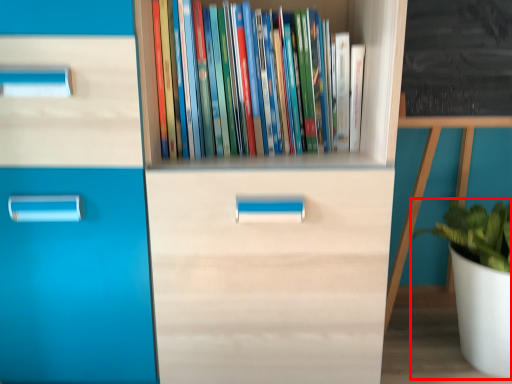
Question: From the image's perspective, where is houseplant (annotated by the red box) located relative to book?

Choices:
 (A) above
 (B) below

Answer: (B)